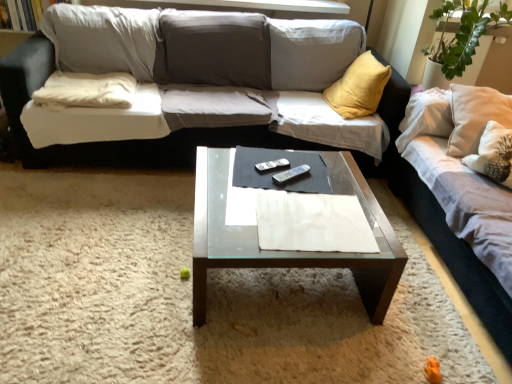
The height and width of the screenshot is (384, 512). Describe the element at coordinates (453, 252) in the screenshot. I see `light beige fabric couch at right, the 1th studio couch from the right` at that location.

What do you see at coordinates (106, 142) in the screenshot?
I see `white fabric couch at center, placed as the 1th studio couch when sorted from left to right` at bounding box center [106, 142].

You are a GUI agent. You are given a task and a screenshot of the screen. Output one action in this format:
    pyautogui.click(x=<x>, y=<y>)
    Task: Click on the black plastic remote at center, which is the second remote from top to bottom
    Image resolution: width=512 pixels, height=384 pixels.
    Given the screenshot: What is the action you would take?
    pyautogui.click(x=290, y=174)

Describe the element at coordinates (290, 174) in the screenshot. The width and height of the screenshot is (512, 384). I see `black plastic remote at center, which is the second remote from top to bottom` at that location.

The image size is (512, 384). What do you see at coordinates (272, 165) in the screenshot? I see `silver metallic remote at center, marked as the 2th remote in a bottom-to-top arrangement` at bounding box center [272, 165].

In order to face white soft pillow at left, should I rotate leftwards or rightwards?

It's best to rotate left around 20.976 degrees.

The height and width of the screenshot is (384, 512). What do you see at coordinates (289, 251) in the screenshot?
I see `transparent glass coffee table at center` at bounding box center [289, 251].

Find the location of a particular element. The width and height of the screenshot is (512, 384). light beige fabric couch at right, the 1th studio couch from the right is located at coordinates (453, 252).

Are white soft pillow at left and white fabric couch at center, positioned as the second studio couch in right-to-left order, located far from each other?

No, white soft pillow at left is not far from white fabric couch at center, positioned as the second studio couch in right-to-left order.

How distant is white soft pillow at left from white fabric couch at center, placed as the 1th studio couch when sorted from left to right?

white soft pillow at left is 10.58 inches from white fabric couch at center, placed as the 1th studio couch when sorted from left to right.

Considering the points (117, 106) and (19, 57), which point is in front, point (117, 106) or point (19, 57)?

Positioned in front is point (19, 57).

Can you confirm if white soft pillow at left is thinner than white fabric couch at center, placed as the 1th studio couch when sorted from left to right?

Correct, the width of white soft pillow at left is less than that of white fabric couch at center, placed as the 1th studio couch when sorted from left to right.

Is transparent glass coffee table at center beside black plastic remote at center, which ranks as the first remote in bottom-to-top order?

No, transparent glass coffee table at center is not making contact with black plastic remote at center, which ranks as the first remote in bottom-to-top order.

In the scene shown: Is transparent glass coffee table at center completely or partially outside of black plastic remote at center, which is the second remote from top to bottom?

Yes.

Does transparent glass coffee table at center have a smaller size compared to black plastic remote at center, which is the second remote from top to bottom?

No.

From the image's perspective, does transparent glass coffee table at center appear higher than black plastic remote at center, which is the second remote from top to bottom?

Actually, transparent glass coffee table at center appears below black plastic remote at center, which is the second remote from top to bottom, in the image.

Between transparent glass coffee table at center and silver metallic remote at center, marked as the 1th remote in a top-to-bottom arrangement, which one appears on the left side from the viewer's perspective?

silver metallic remote at center, marked as the 1th remote in a top-to-bottom arrangement, is more to the left.

Which object is closer to the camera taking this photo, transparent glass coffee table at center or silver metallic remote at center, marked as the 2th remote in a bottom-to-top arrangement?

transparent glass coffee table at center.

Is transparent glass coffee table at center bigger than silver metallic remote at center, marked as the 2th remote in a bottom-to-top arrangement?

Correct, transparent glass coffee table at center is larger in size than silver metallic remote at center, marked as the 2th remote in a bottom-to-top arrangement.

Considering the sizes of objects transparent glass coffee table at center and white fabric couch at center, placed as the 1th studio couch when sorted from left to right, in the image provided, who is wider, transparent glass coffee table at center or white fabric couch at center, placed as the 1th studio couch when sorted from left to right,?

With larger width is white fabric couch at center, placed as the 1th studio couch when sorted from left to right.

Does transparent glass coffee table at center have a greater height compared to white fabric couch at center, placed as the 1th studio couch when sorted from left to right?

No.

Which is nearer, (x=196, y=315) or (x=35, y=38)?

Point (x=196, y=315) is positioned closer to the camera compared to point (x=35, y=38).

In the image, is transparent glass coffee table at center positioned in front of or behind white fabric couch at center, positioned as the second studio couch in right-to-left order?

transparent glass coffee table at center is in front of white fabric couch at center, positioned as the second studio couch in right-to-left order.

Is transparent glass coffee table at center taller or shorter than light beige fabric couch at right, the 1th studio couch from the right?

In the image, transparent glass coffee table at center appears to be shorter than light beige fabric couch at right, the 1th studio couch from the right.

Based on their sizes in the image, would you say transparent glass coffee table at center is bigger or smaller than light beige fabric couch at right, positioned as the second studio couch in left-to-right order?

transparent glass coffee table at center is smaller than light beige fabric couch at right, positioned as the second studio couch in left-to-right order.

Do you think transparent glass coffee table at center is within light beige fabric couch at right, the 1th studio couch from the right, or outside of it?

The correct answer is: outside.

From a real-world perspective, is transparent glass coffee table at center positioned over light beige fabric couch at right, positioned as the second studio couch in left-to-right order, based on gravity?

No.

Between point (503, 305) and point (288, 254), which one is positioned in front?

The point (288, 254) is closer.

In terms of width, does light beige fabric couch at right, positioned as the second studio couch in left-to-right order, look wider or thinner when compared to transparent glass coffee table at center?

light beige fabric couch at right, positioned as the second studio couch in left-to-right order, is wider than transparent glass coffee table at center.

Is light beige fabric couch at right, the 1th studio couch from the right, beside transparent glass coffee table at center?

No, light beige fabric couch at right, the 1th studio couch from the right, is not making contact with transparent glass coffee table at center.

Is light beige fabric couch at right, positioned as the second studio couch in left-to-right order, positioned beyond the bounds of transparent glass coffee table at center?

Yes, light beige fabric couch at right, positioned as the second studio couch in left-to-right order, is not within transparent glass coffee table at center.

Can you see silver metallic remote at center, marked as the 2th remote in a bottom-to-top arrangement, touching black plastic remote at center, which is the second remote from top to bottom?

Yes, the surface of silver metallic remote at center, marked as the 2th remote in a bottom-to-top arrangement, is in contact with black plastic remote at center, which is the second remote from top to bottom.

From the image's perspective, is silver metallic remote at center, marked as the 1th remote in a top-to-bottom arrangement, beneath black plastic remote at center, which ranks as the first remote in bottom-to-top order?

No, from the image's perspective, silver metallic remote at center, marked as the 1th remote in a top-to-bottom arrangement, is not beneath black plastic remote at center, which ranks as the first remote in bottom-to-top order.

Is silver metallic remote at center, marked as the 2th remote in a bottom-to-top arrangement, not within black plastic remote at center, which is the second remote from top to bottom?

Yes.

From a real-world perspective, is silver metallic remote at center, marked as the 1th remote in a top-to-bottom arrangement, positioned above or below black plastic remote at center, which ranks as the first remote in bottom-to-top order?

silver metallic remote at center, marked as the 1th remote in a top-to-bottom arrangement, is situated lower than black plastic remote at center, which ranks as the first remote in bottom-to-top order, in the real world.

At what (x,y) coordinates should I click in order to perform the action: click on the 1st studio couch in front of the white soft pillow at left. Please return your answer as a coordinate pair (x, y). The image size is (512, 384). Looking at the image, I should click on (106, 142).

The height and width of the screenshot is (384, 512). Identify the location of coffee table below the black plastic remote at center, which is the second remote from top to bottom (from the image's perspective). (289, 251).

Which object lies further to the anchor point black plastic remote at center, which is the second remote from top to bottom, silver metallic remote at center, marked as the 1th remote in a top-to-bottom arrangement, or light beige fabric couch at right, positioned as the second studio couch in left-to-right order?

light beige fabric couch at right, positioned as the second studio couch in left-to-right order, lies further to black plastic remote at center, which is the second remote from top to bottom, than the other object.

Estimate the real-world distances between objects in this image. Which object is further from transparent glass coffee table at center, white fabric couch at center, placed as the 1th studio couch when sorted from left to right, or light beige fabric couch at right, positioned as the second studio couch in left-to-right order?

white fabric couch at center, placed as the 1th studio couch when sorted from left to right, is further to transparent glass coffee table at center.

Which object lies further to the anchor point black plastic remote at center, which ranks as the first remote in bottom-to-top order, white soft pillow at left or light beige fabric couch at right, positioned as the second studio couch in left-to-right order?

Among the two, white soft pillow at left is located further to black plastic remote at center, which ranks as the first remote in bottom-to-top order.

When comparing their distances from white fabric couch at center, positioned as the second studio couch in right-to-left order, does black plastic remote at center, which is the second remote from top to bottom, or transparent glass coffee table at center seem further?

Based on the image, black plastic remote at center, which is the second remote from top to bottom, appears to be further to white fabric couch at center, positioned as the second studio couch in right-to-left order.

Looking at the image, which one is located further to white soft pillow at left, light beige fabric couch at right, positioned as the second studio couch in left-to-right order, or white fabric couch at center, placed as the 1th studio couch when sorted from left to right?

light beige fabric couch at right, positioned as the second studio couch in left-to-right order, is further to white soft pillow at left.

Estimate the real-world distances between objects in this image. Which object is further from silver metallic remote at center, marked as the 2th remote in a bottom-to-top arrangement, transparent glass coffee table at center or light beige fabric couch at right, the 1th studio couch from the right?

The object further to silver metallic remote at center, marked as the 2th remote in a bottom-to-top arrangement, is light beige fabric couch at right, the 1th studio couch from the right.

Estimate the real-world distances between objects in this image. Which object is further from light beige fabric couch at right, the 1th studio couch from the right, silver metallic remote at center, marked as the 2th remote in a bottom-to-top arrangement, or black plastic remote at center, which ranks as the first remote in bottom-to-top order?

Among the two, silver metallic remote at center, marked as the 2th remote in a bottom-to-top arrangement, is located further to light beige fabric couch at right, the 1th studio couch from the right.

When comparing their distances from white soft pillow at left, does white fabric couch at center, placed as the 1th studio couch when sorted from left to right, or transparent glass coffee table at center seem closer?

white fabric couch at center, placed as the 1th studio couch when sorted from left to right, is closer to white soft pillow at left.

What are the coordinates of `remote between silver metallic remote at center, marked as the 1th remote in a top-to-bottom arrangement, and light beige fabric couch at right, the 1th studio couch from the right` in the screenshot? It's located at (290, 174).

Where is `remote located between white soft pillow at left and transparent glass coffee table at center in the left-right direction`? remote located between white soft pillow at left and transparent glass coffee table at center in the left-right direction is located at coordinates (272, 165).

This screenshot has width=512, height=384. Find the location of `coffee table located between white soft pillow at left and light beige fabric couch at right, positioned as the second studio couch in left-to-right order, in the left-right direction`. coffee table located between white soft pillow at left and light beige fabric couch at right, positioned as the second studio couch in left-to-right order, in the left-right direction is located at coordinates (289, 251).

The width and height of the screenshot is (512, 384). In order to click on remote between white fabric couch at center, placed as the 1th studio couch when sorted from left to right, and black plastic remote at center, which is the second remote from top to bottom, vertically in this screenshot , I will do `click(272, 165)`.